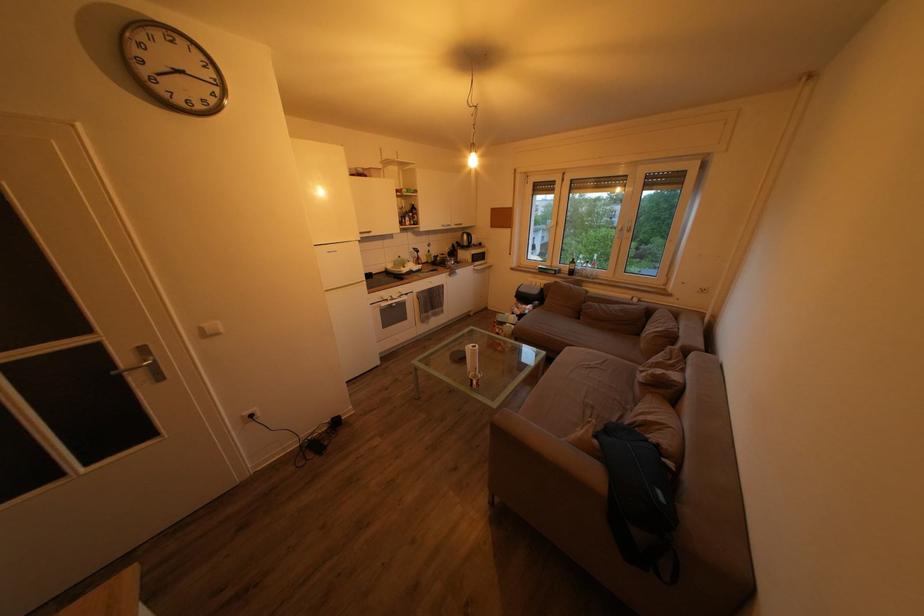
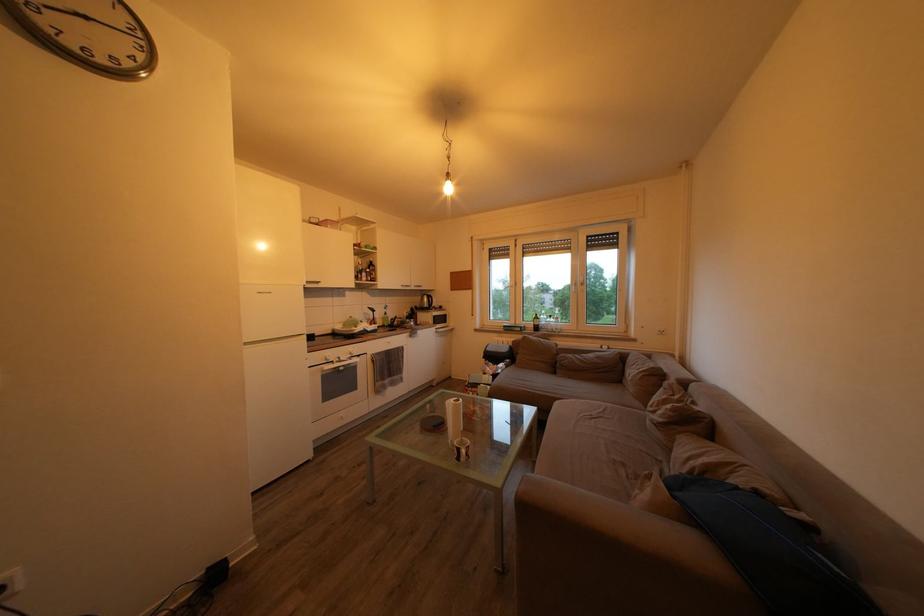
In the second image, find the point that corresponds to [426,257] in the first image.

(381, 317)